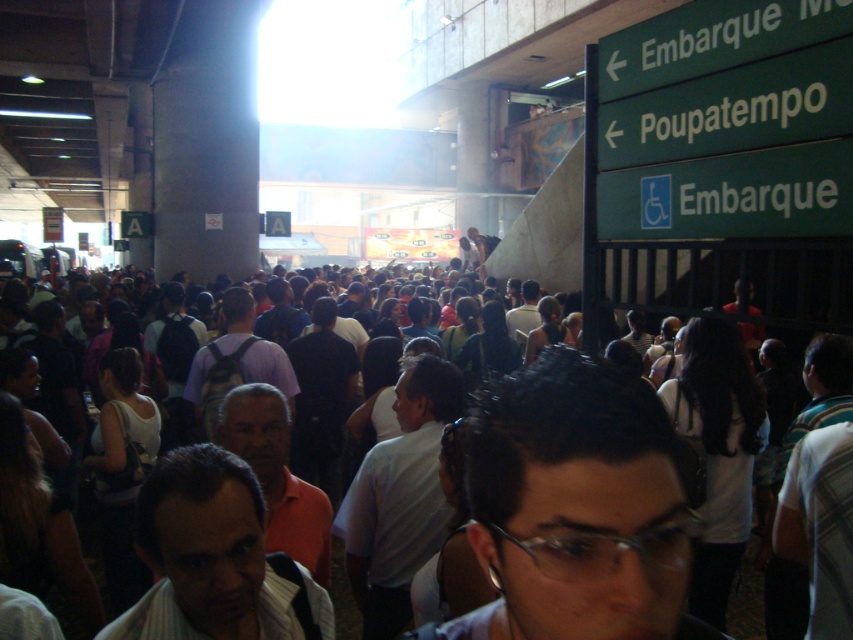
Does striped shirt at center appear over dark blue backpack at center?

No.

Looking at this image, is striped shirt at center wider than dark blue backpack at center?

Incorrect, striped shirt at center's width does not surpass dark blue backpack at center's.

Does point (167, 609) come farther from viewer compared to point (299, 385)?

No, it is not.

This screenshot has height=640, width=853. I want to click on striped shirt at center, so click(x=215, y=557).

Can you confirm if striped shirt at center is positioned below orange matte shirt at center?

Incorrect, striped shirt at center is not positioned below orange matte shirt at center.

The height and width of the screenshot is (640, 853). Find the location of `striped shirt at center`. striped shirt at center is located at coordinates (215, 557).

Identify the location of striped shirt at center. (215, 557).

Is dark hair at center shorter than dark purple shirt at center?

Yes.

Who is higher up, dark hair at center or dark purple shirt at center?

Positioned higher is dark hair at center.

At what (x,y) coordinates should I click in order to perform the action: click on dark hair at center. Please return your answer as a coordinate pair (x, y). Image resolution: width=853 pixels, height=640 pixels. Looking at the image, I should click on (573, 508).

The width and height of the screenshot is (853, 640). Identify the location of dark hair at center. (573, 508).